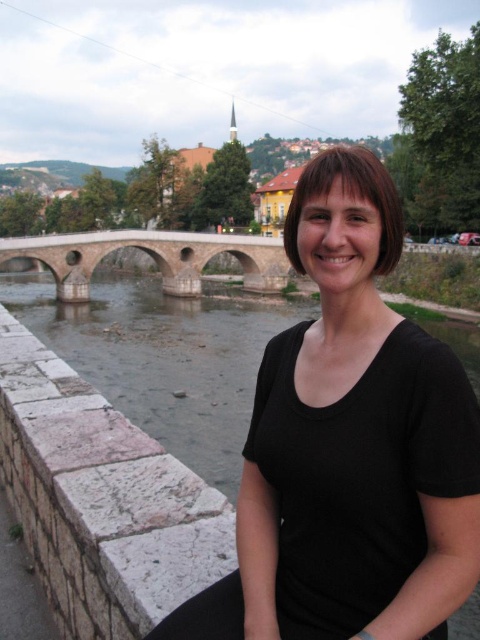
Can you confirm if gray stone river at center is positioned to the right of stone arch bridge at center?

Correct, you'll find gray stone river at center to the right of stone arch bridge at center.

Find the location of a particular element. The image size is (480, 640). gray stone river at center is located at coordinates (164, 358).

Between point (197, 300) and point (254, 243), which one is positioned behind?

The point (254, 243) is more distant.

You are a GUI agent. You are given a task and a screenshot of the screen. Output one action in this format:
    pyautogui.click(x=<x>, y=<y>)
    Task: Click on the gray stone river at center
    
    Given the screenshot: What is the action you would take?
    pyautogui.click(x=164, y=358)

Who is positioned more to the right, black matte shirt at center or gray stone river at center?

black matte shirt at center is more to the right.

Can you confirm if black matte shirt at center is positioned to the left of gray stone river at center?

Incorrect, black matte shirt at center is not on the left side of gray stone river at center.

Between point (399, 396) and point (147, 362), which one is positioned behind?

Point (147, 362)

Image resolution: width=480 pixels, height=640 pixels. I want to click on black matte shirt at center, so click(x=348, y=445).

Which of these two, black matte shirt at center or stone arch bridge at center, stands shorter?

With less height is stone arch bridge at center.

The height and width of the screenshot is (640, 480). Identify the location of black matte shirt at center. (348, 445).

At what (x,y) coordinates should I click in order to perform the action: click on black matte shirt at center. Please return your answer as a coordinate pair (x, y). The height and width of the screenshot is (640, 480). Looking at the image, I should click on click(x=348, y=445).